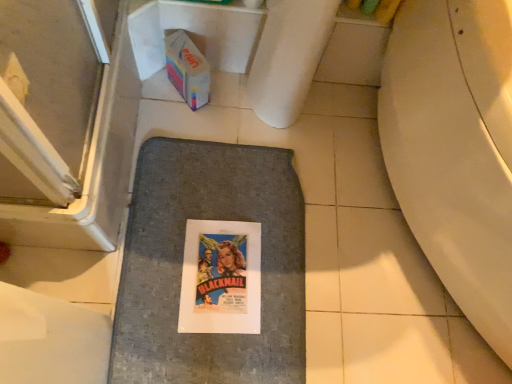
Where is `vacant space to the left of multicolored cardboard box at upper left`? The height and width of the screenshot is (384, 512). vacant space to the left of multicolored cardboard box at upper left is located at coordinates (157, 88).